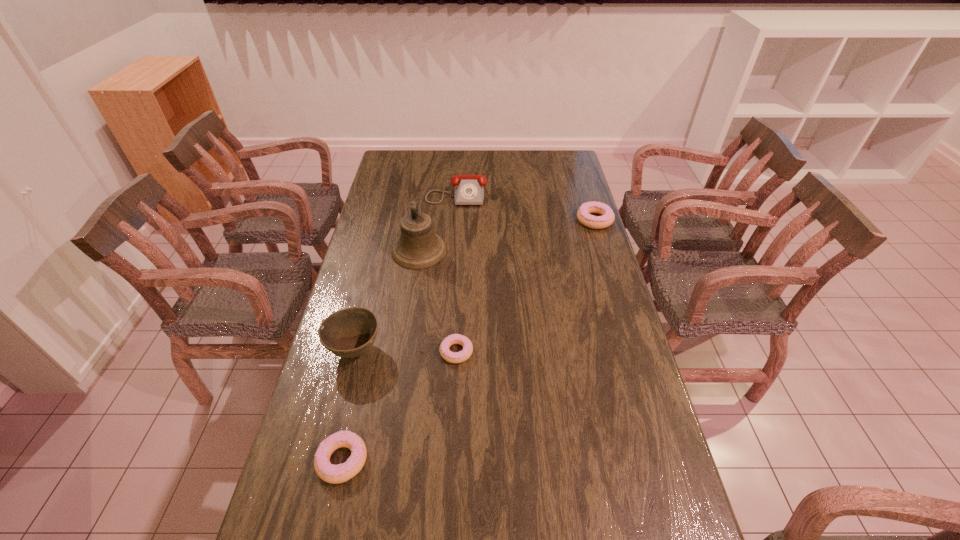
The width and height of the screenshot is (960, 540). In order to click on object at the right edge in this screenshot , I will do `click(583, 214)`.

In the image, there is a desktop. Where is `free space at the far edge`? The image size is (960, 540). free space at the far edge is located at coordinates (521, 150).

Identify the location of free space at the near edge of the desktop. This screenshot has width=960, height=540. (407, 523).

In order to click on free location at the left edge in this screenshot , I will do point(337,378).

Identify the location of free point at the right edge. (588, 324).

Identify the location of vacant space that's between the farthest object and the bowl. (406, 271).

Find the location of a particular element. free point between the second shortest doughnut and the shortest doughnut is located at coordinates (399, 406).

Locate an element on the screen. This screenshot has height=540, width=960. vacant space in between the fifth shortest object and the shortest object is located at coordinates (406, 351).

Find the location of a particular element. free space between the fifth nearest object and the fifth shortest object is located at coordinates (475, 285).

Identify the location of vacant region between the fifth shortest object and the second doughnut from right to left. click(x=406, y=351).